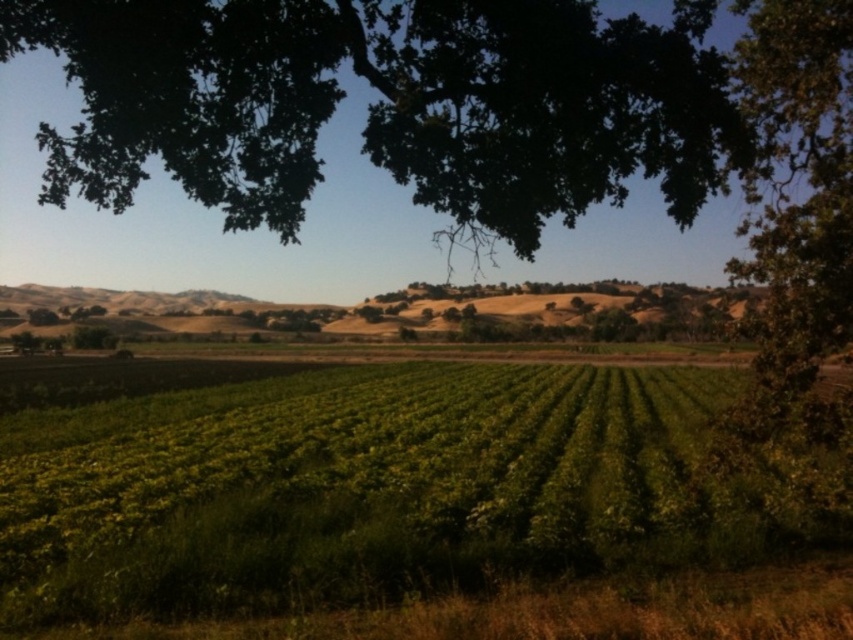
You are standing at the point closest to the bottom of the image. Which of the two points, point (782,486) or point (154,150), is farther away from you?

Point (782,486) is farther away from you because it is positioned behind point (154,150) in the image.

You are standing in the middle of the green leafy field at center and want to walk towards the green leafy tree at upper center. Which direction should you head?

The green leafy field at center is to the right of the green leafy tree at upper center, so to reach the tree, you should head to the left.